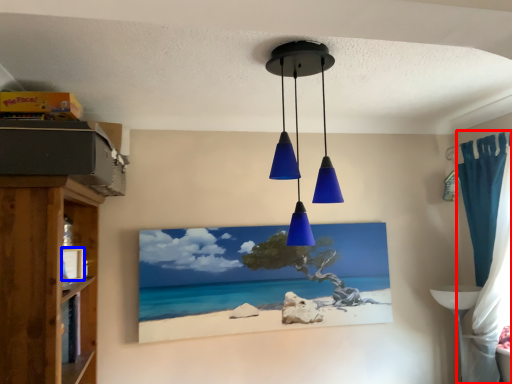
Question: Which point is closer to the camera, curtain (highlighted by a red box) or picture frame (highlighted by a blue box)?

Choices:
 (A) curtain
 (B) picture frame

Answer: (B)